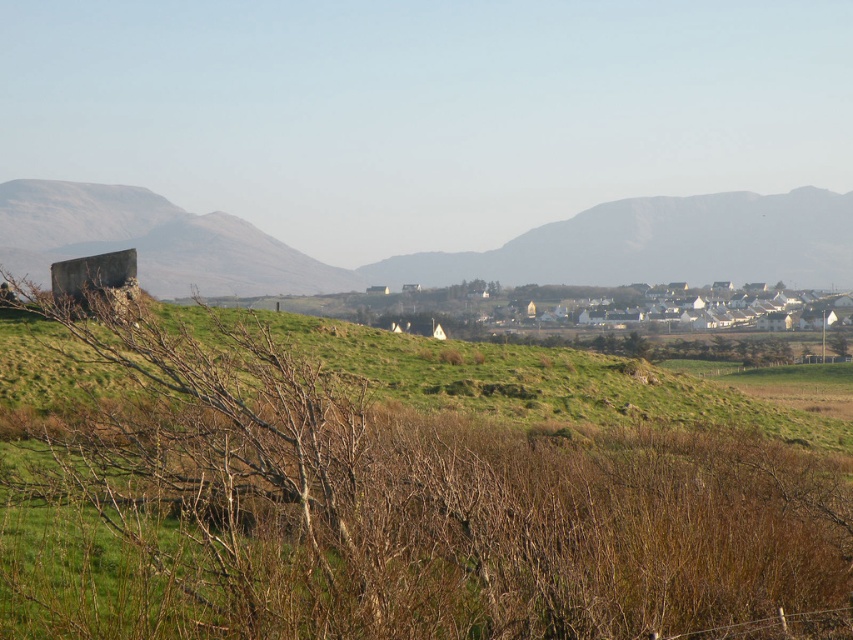
Is brown dry bush at left smaller than smooth gray rock at left?

No.

Can you confirm if brown dry bush at left is thinner than smooth gray rock at left?

No, brown dry bush at left is not thinner than smooth gray rock at left.

Which is in front, point (160, 328) or point (56, 204)?

Positioned in front is point (160, 328).

Locate an element on the screen. The height and width of the screenshot is (640, 853). brown dry bush at left is located at coordinates (393, 488).

Who is more forward, (556,241) or (169,220)?

Point (169,220) is more forward.

Is point (625, 221) positioned before point (132, 193)?

Yes, point (625, 221) is in front of point (132, 193).

Does point (647, 224) come farther from viewer compared to point (184, 230)?

That is True.

Where is `gray rocky mountain at center`? Image resolution: width=853 pixels, height=640 pixels. gray rocky mountain at center is located at coordinates (660, 244).

Who is more forward, (318, 442) or (383, 269)?

Point (318, 442) is in front.

Looking at this image, can you confirm if brown dry bush at left is positioned to the right of gray rocky mountain at center?

No, brown dry bush at left is not to the right of gray rocky mountain at center.

Identify the location of brown dry bush at left. The height and width of the screenshot is (640, 853). (393, 488).